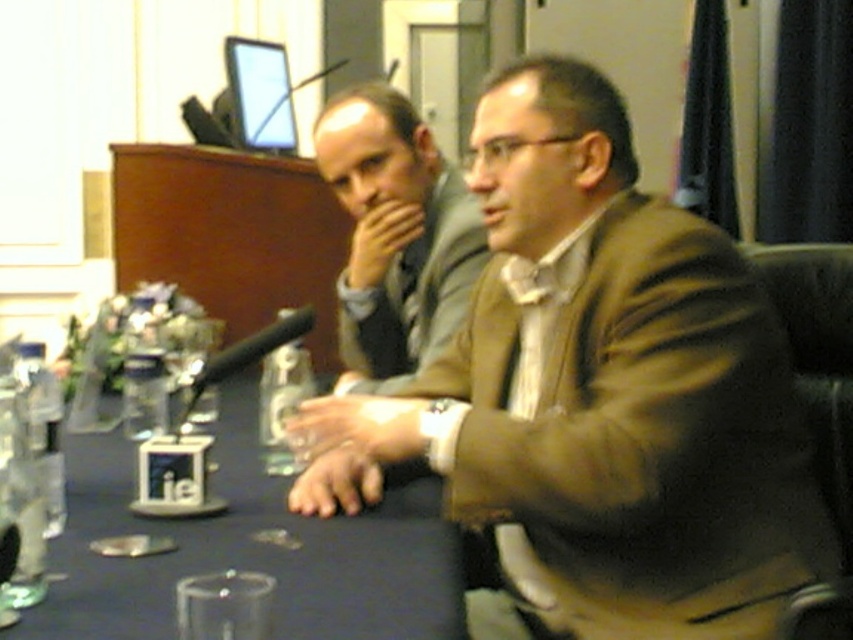
In the scene shown: You are attending a formal event and need to place a name tag on the table. Given the arrangement of the matte brown jacket at center and the blue fabric table at center, where should you place the name tag?

The blue fabric table at center is behind the matte brown jacket at center, so you should place the name tag on the blue fabric table at center since it is the table surface.

You are attending a formal event and need to locate your matte brown jacket. The event venue has a coordinate system where the bottom left corner is the origin point. The venue map shows that the jacket is at point (596, 396). If you are currently at the origin, which direction should you move to reach the jacket?

The matte brown jacket at center is located at point (596, 396). Since the coordinate system starts at the bottom left corner, moving towards the right increases the x coordinate and moving upwards increases the y coordinate. Therefore, to reach the jacket from the origin, you should move northeast.